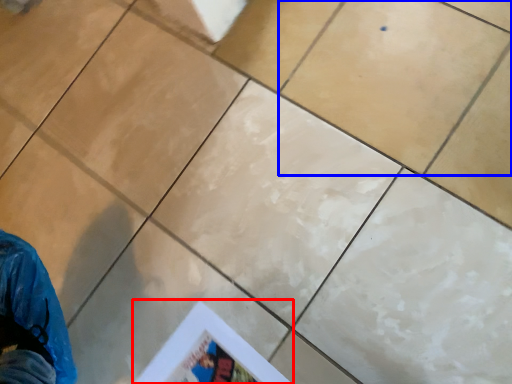
Question: Which point is further to the camera, poster page (highlighted by a red box) or ceramic tile (highlighted by a blue box)?

Choices:
 (A) poster page
 (B) ceramic tile

Answer: (B)